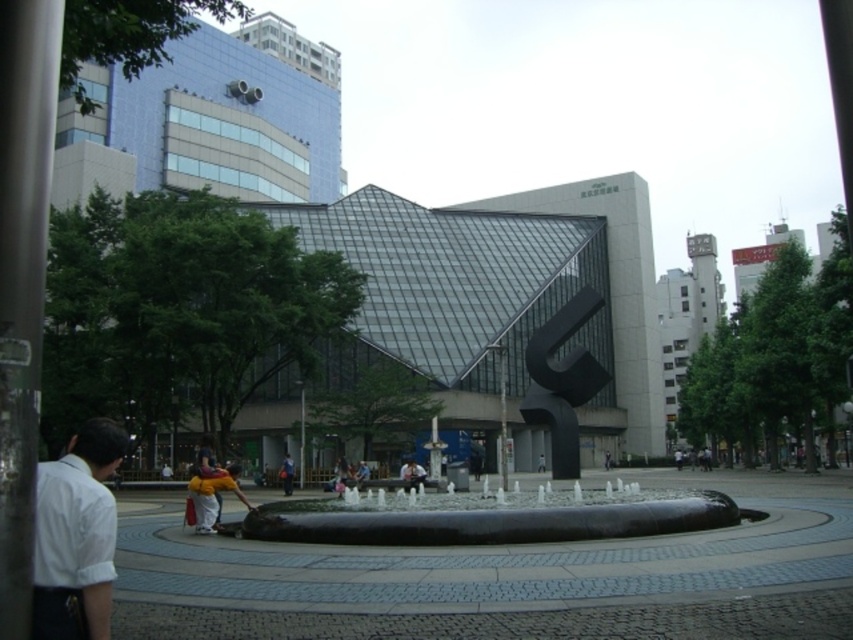
Question: Can you confirm if black polished stone fountain at center is positioned to the right of black polished water feature at center?

Choices:
 (A) no
 (B) yes

Answer: (B)

Question: Which point is closer to the camera taking this photo?

Choices:
 (A) (474, 516)
 (B) (289, 465)
 (C) (33, 588)
 (D) (474, 520)

Answer: (C)

Question: Is yellow fabric jacket at lower left to the left of yellow fabric jacket at center from the viewer's perspective?

Choices:
 (A) no
 (B) yes

Answer: (A)

Question: Which point is farther to the camera?

Choices:
 (A) yellow fabric jacket at lower left
 (B) yellow fabric jacket at center
 (C) white matte shirt at lower left
 (D) black polished stone fountain at center

Answer: (B)

Question: Is black polished water feature at center to the left of white matte shirt at lower left from the viewer's perspective?

Choices:
 (A) no
 (B) yes

Answer: (A)

Question: Among these points, which one is farthest from the camera?

Choices:
 (A) pyautogui.click(x=631, y=528)
 (B) pyautogui.click(x=440, y=524)

Answer: (A)